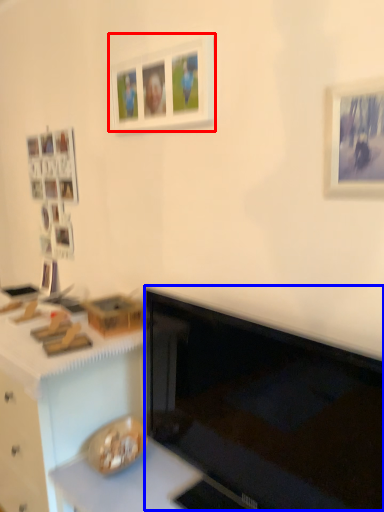
Question: Which of the following is the farthest to the observer, picture frame (highlighted by a red box) or computer monitor (highlighted by a blue box)?

Choices:
 (A) picture frame
 (B) computer monitor

Answer: (A)